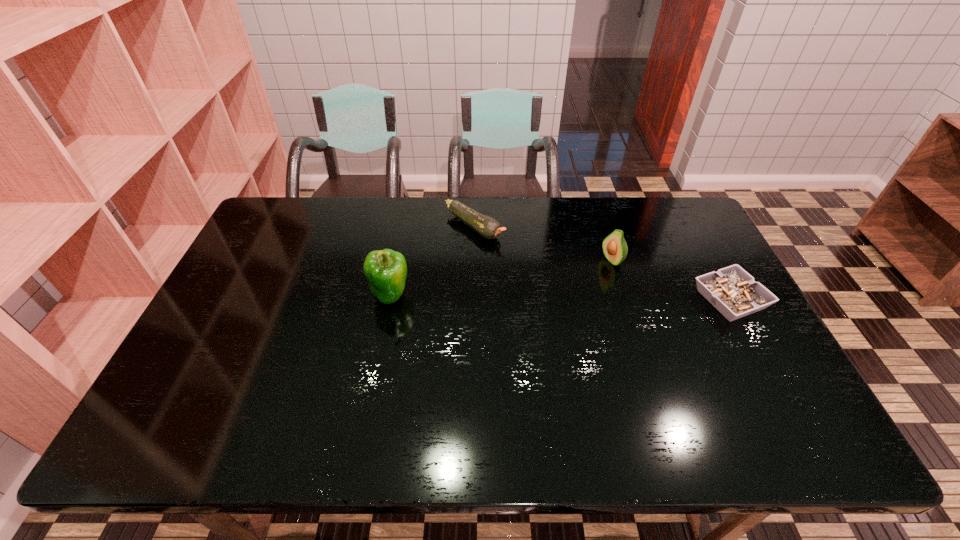
The height and width of the screenshot is (540, 960). I want to click on free space between the leftmost object and the ashtray, so click(560, 298).

I want to click on free space between the second object from right to left and the bell pepper, so click(x=501, y=278).

Locate an element on the screen. vacant area that lies between the tallest object and the farthest object is located at coordinates (432, 261).

Locate an element on the screen. The height and width of the screenshot is (540, 960). free point between the avocado and the rightmost object is located at coordinates (671, 280).

Identify which object is the second closest to the zucchini. Please provide its 2D coordinates. Your answer should be formatted as a tuple, i.e. [(x, y)], where the tuple contains the x and y coordinates of a point satisfying the conditions above.

[(614, 246)]

Select which object appears as the closest to the third object from left to right. Please provide its 2D coordinates. Your answer should be formatted as a tuple, i.e. [(x, y)], where the tuple contains the x and y coordinates of a point satisfying the conditions above.

[(731, 290)]

The image size is (960, 540). Find the location of `free space that satisfies the following two spatial constraints: 1. on the front side of the ashtray; 2. on the left side of the bell pepper`. free space that satisfies the following two spatial constraints: 1. on the front side of the ashtray; 2. on the left side of the bell pepper is located at coordinates (389, 300).

This screenshot has height=540, width=960. What are the coordinates of `free space that satisfies the following two spatial constraints: 1. on the back side of the second tallest object; 2. on the left side of the leftmost object` in the screenshot? It's located at (396, 261).